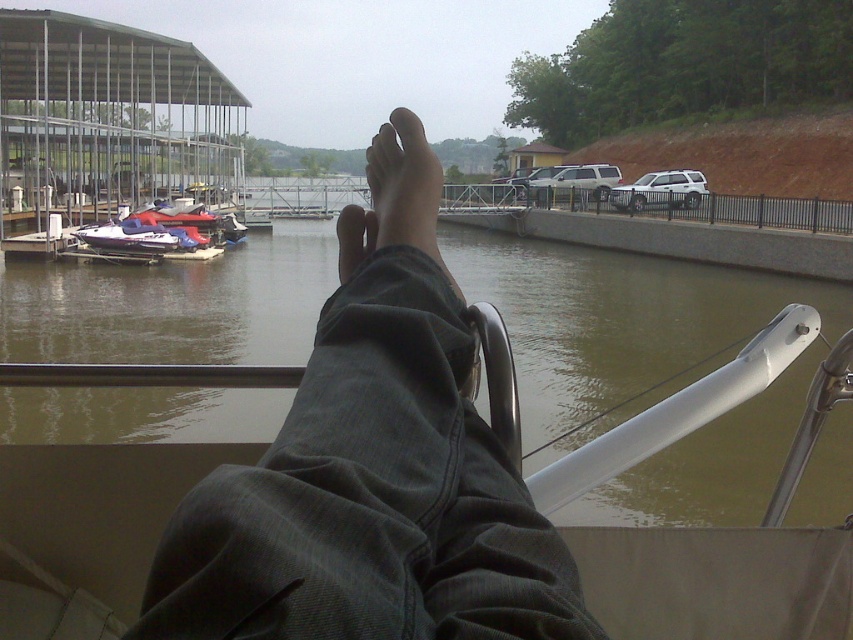
Question: Which object appears farthest from the camera in this image?

Choices:
 (A) brown murky water at center
 (B) blue and white plastic boat at left
 (C) jeans at center
 (D) matte black foot at center

Answer: (B)

Question: Considering the relative positions of jeans at center and blue and white plastic boat at left in the image provided, where is jeans at center located with respect to blue and white plastic boat at left?

Choices:
 (A) right
 (B) left

Answer: (A)

Question: Does jeans at center appear under matte black foot at center?

Choices:
 (A) yes
 (B) no

Answer: (A)

Question: Considering the real-world distances, which object is farthest from the blue and white plastic boat at left?

Choices:
 (A) brown murky water at center
 (B) skinny barefoot at center

Answer: (B)

Question: Among these objects, which one is farthest from the camera?

Choices:
 (A) matte black foot at center
 (B) blue and white plastic boat at left
 (C) jeans at center
 (D) brown murky water at center

Answer: (B)

Question: Can you confirm if blue and white plastic boat at left is positioned to the left of matte black foot at center?

Choices:
 (A) no
 (B) yes

Answer: (B)